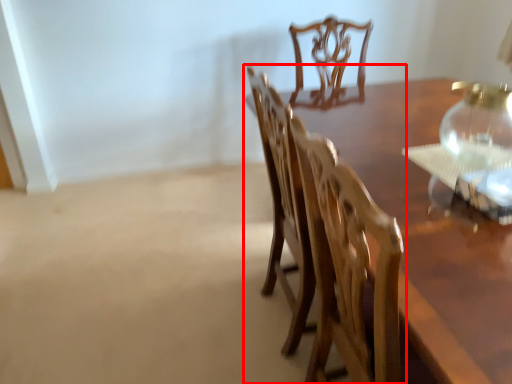
Question: From the image's perspective, what is the correct spatial positioning of chair (annotated by the red box) in reference to glass vase?

Choices:
 (A) above
 (B) below

Answer: (B)